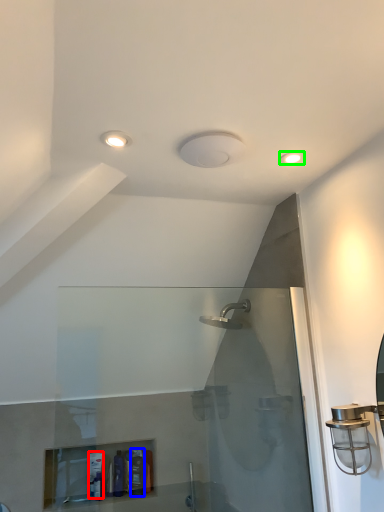
Question: Based on their relative distances, which object is nearer to toiletry (highlighted by a red box)? Choose from toiletry (highlighted by a blue box) and light fixture (highlighted by a green box).

Choices:
 (A) toiletry
 (B) light fixture

Answer: (A)